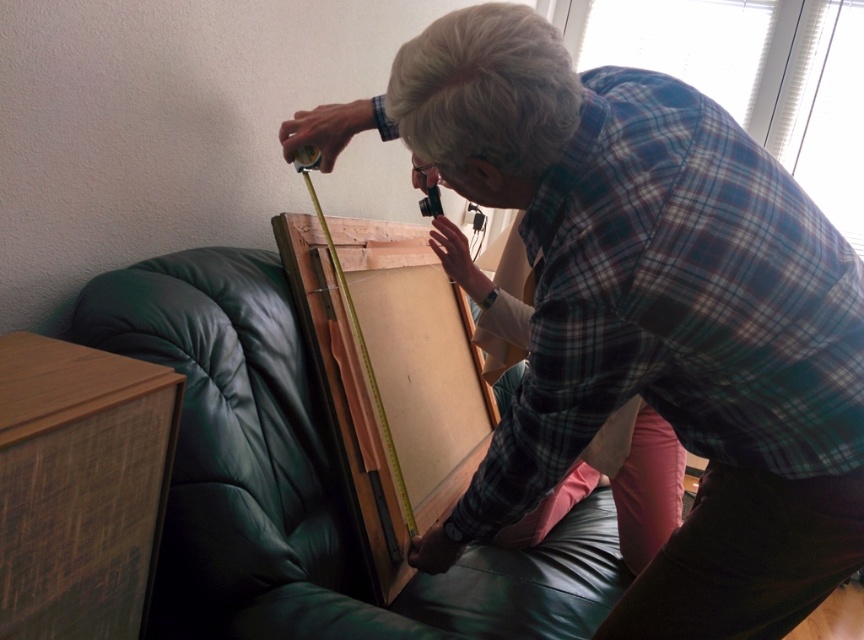
Does green leather couch at center have a greater width compared to wooden at left?

Yes.

Is green leather couch at center shorter than wooden at left?

Correct, green leather couch at center is not as tall as wooden at left.

Locate an element on the screen. Image resolution: width=864 pixels, height=640 pixels. green leather couch at center is located at coordinates (302, 481).

Locate an element on the screen. The image size is (864, 640). green leather couch at center is located at coordinates (302, 481).

Describe the element at coordinates (80, 486) in the screenshot. I see `brown woven wood at lower left` at that location.

Is point (43, 634) in front of point (334, 253)?

Yes, it is.

Describe the element at coordinates (80, 486) in the screenshot. This screenshot has width=864, height=640. I see `brown woven wood at lower left` at that location.

Where is `brown woven wood at lower left`? Image resolution: width=864 pixels, height=640 pixels. brown woven wood at lower left is located at coordinates (80, 486).

Does green leather couch at center have a lesser width compared to wooden paint brush at center?

No.

Is green leather couch at center smaller than wooden paint brush at center?

Actually, green leather couch at center might be larger than wooden paint brush at center.

Does point (310, 556) come farther from viewer compared to point (350, 317)?

No.

Identify the location of green leather couch at center. This screenshot has height=640, width=864. (302, 481).